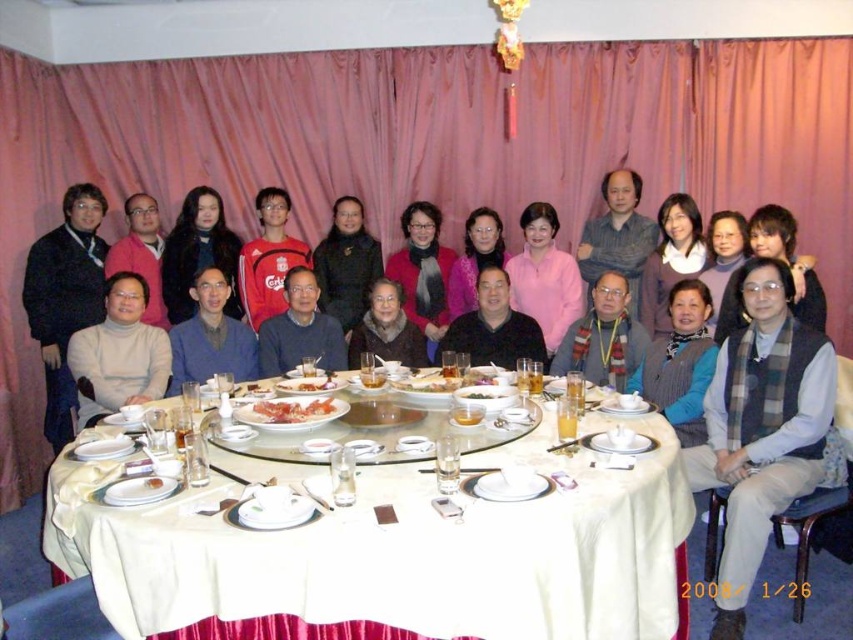
Between gray sweater at center and white porcelain bowl at center, which one is positioned lower?

white porcelain bowl at center is lower down.

Between gray sweater at center and white porcelain bowl at center, which one appears on the right side from the viewer's perspective?

From the viewer's perspective, white porcelain bowl at center appears more on the right side.

Between point (277, 316) and point (502, 388), which one is positioned in front?

Point (502, 388) is in front.

Locate an element on the screen. This screenshot has height=640, width=853. gray sweater at center is located at coordinates (300, 330).

Between gray wool vest at center and matte white sweater at center, which one has more height?

gray wool vest at center

Is point (746, 436) closer to camera compared to point (103, 376)?

Yes, it is in front of point (103, 376).

Locate an element on the screen. gray wool vest at center is located at coordinates (763, 429).

Is point (734, 589) positioned behind point (308, 282)?

No, it is in front of (308, 282).

Is gray wool vest at center closer to camera compared to gray sweater at center?

That is True.

This screenshot has width=853, height=640. I want to click on gray wool vest at center, so pyautogui.click(x=763, y=429).

This screenshot has width=853, height=640. I want to click on gray wool vest at center, so click(x=763, y=429).